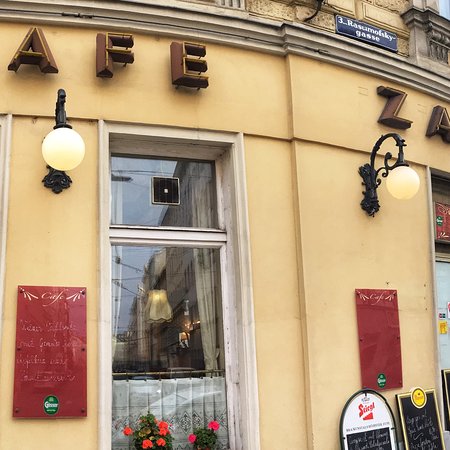
Locate an element on the screen. The width and height of the screenshot is (450, 450). light 1 is located at coordinates (399, 183).